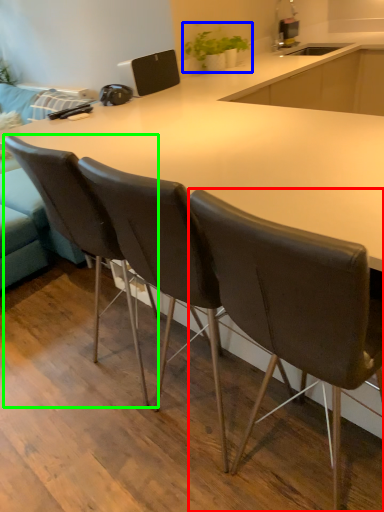
Question: Estimate the real-world distances between objects in this image. Which object is closer to chair (highlighted by a red box), houseplant (highlighted by a blue box) or chair (highlighted by a green box)?

Choices:
 (A) houseplant
 (B) chair

Answer: (B)